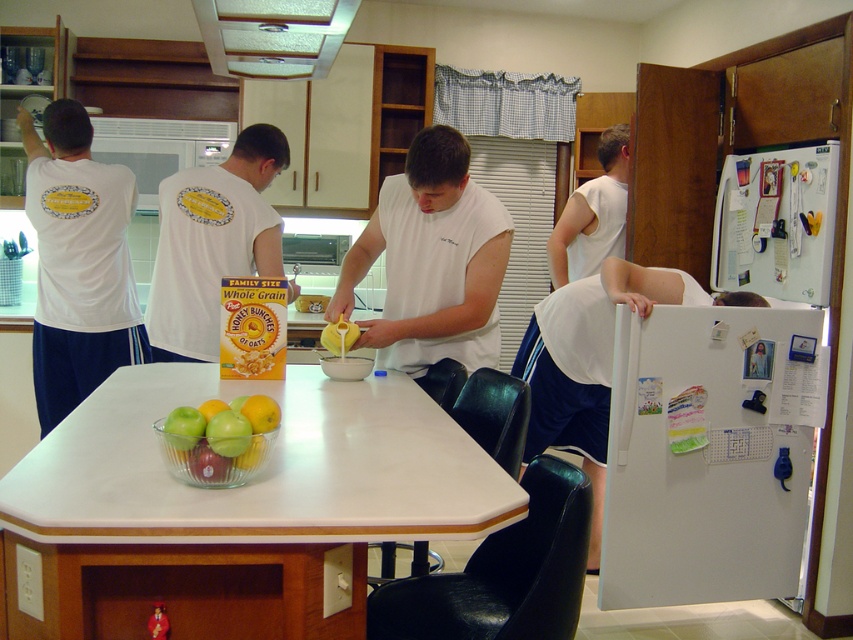
Question: Can you confirm if white matte refrigerator at right is wider than white sleeveless shirt at right?

Choices:
 (A) yes
 (B) no

Answer: (A)

Question: Which point appears farthest from the camera in this image?

Choices:
 (A) (734, 195)
 (B) (409, 193)

Answer: (A)

Question: Considering the real-world distances, which object is farthest from the white matte refrigerator at upper right?

Choices:
 (A) white laminate table at center
 (B) green glass bowl at center
 (C) brushed metal exhaust hood at upper center
 (D) white matte refrigerator at right

Answer: (B)

Question: Where is white cotton shirt at left located in relation to brushed metal exhaust hood at upper center in the image?

Choices:
 (A) below
 (B) above

Answer: (A)

Question: Estimate the real-world distances between objects in this image. Which object is farther from the brushed metal exhaust hood at upper center?

Choices:
 (A) white sleeveless shirt at right
 (B) white matte shirt at center
 (C) white laminate table at center

Answer: (A)

Question: Does white matte refrigerator at right appear under white cotton shirt at left?

Choices:
 (A) yes
 (B) no

Answer: (A)